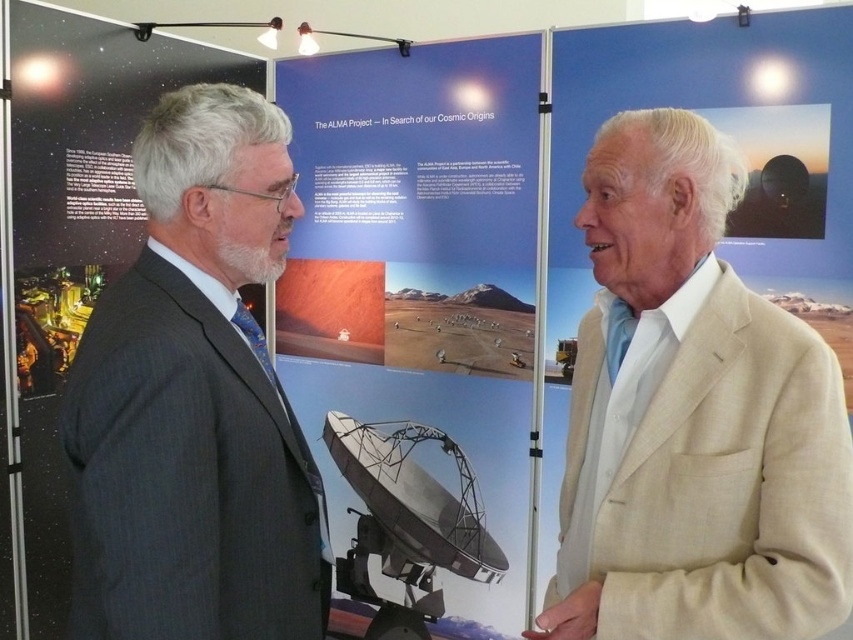
Measure the distance from dark gray suit at left to matte black satellite dish at center.

dark gray suit at left and matte black satellite dish at center are 5.19 feet apart from each other.

From the picture: Who is taller, dark gray suit at left or matte black satellite dish at center?

matte black satellite dish at center is taller.

Is point (201, 358) positioned before point (437, 97)?

That is True.

The width and height of the screenshot is (853, 640). Identify the location of dark gray suit at left. (195, 400).

Who is higher up, beige linen suit at right or dark gray suit at left?

dark gray suit at left

Is beige linen suit at right to the left of dark gray suit at left from the viewer's perspective?

No, beige linen suit at right is not to the left of dark gray suit at left.

I want to click on beige linen suit at right, so click(692, 417).

Describe the element at coordinates (692, 417) in the screenshot. This screenshot has width=853, height=640. I see `beige linen suit at right` at that location.

Who is taller, beige linen suit at right or matte black satellite dish at center?

With more height is matte black satellite dish at center.

The image size is (853, 640). In order to click on beige linen suit at right in this screenshot , I will do `click(692, 417)`.

Where is `beige linen suit at right`? The height and width of the screenshot is (640, 853). beige linen suit at right is located at coordinates (692, 417).